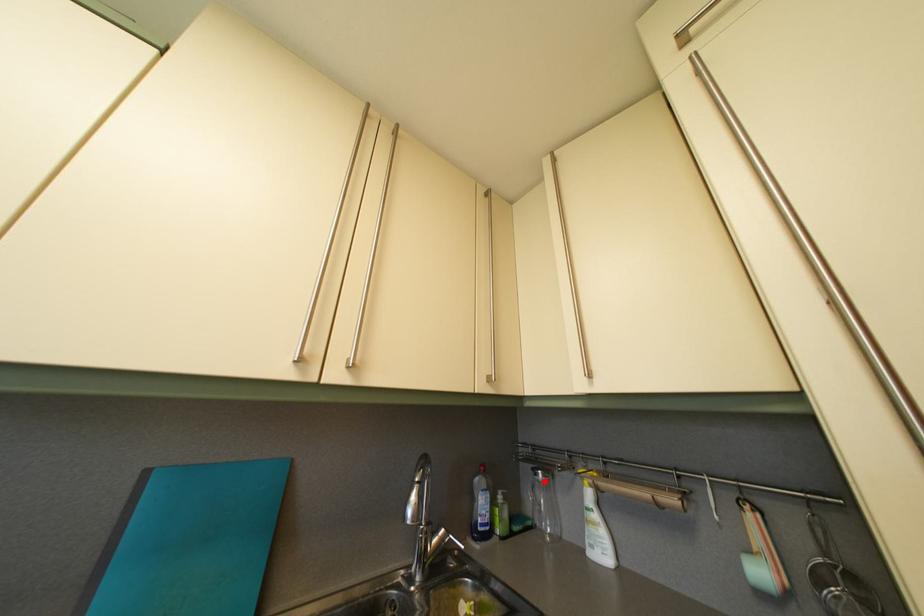
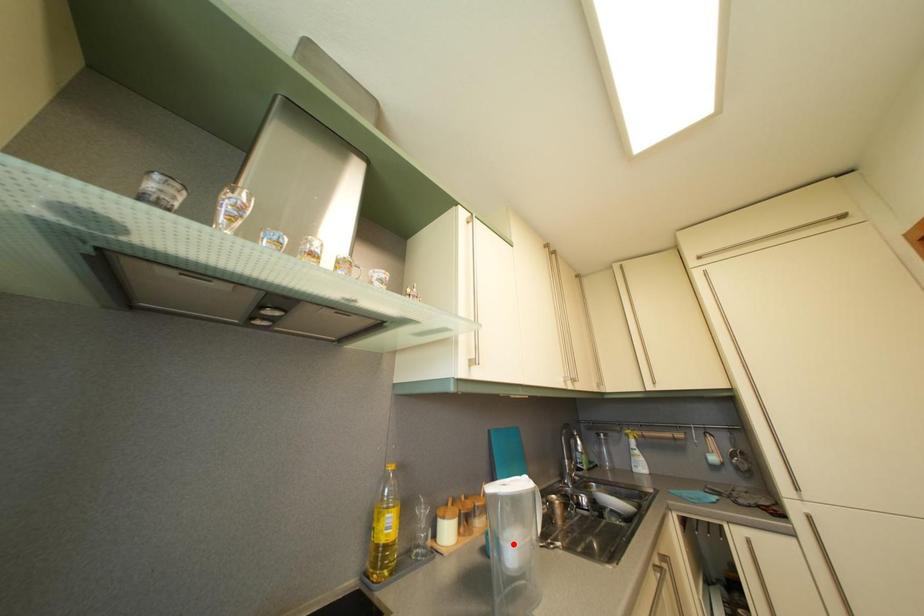
I am providing you with two images of the same scene from different viewpoints. A red point is marked on the first image and another point is marked on the second image. Is the marked point in image1 the same physical position as the marked point in image2?

No